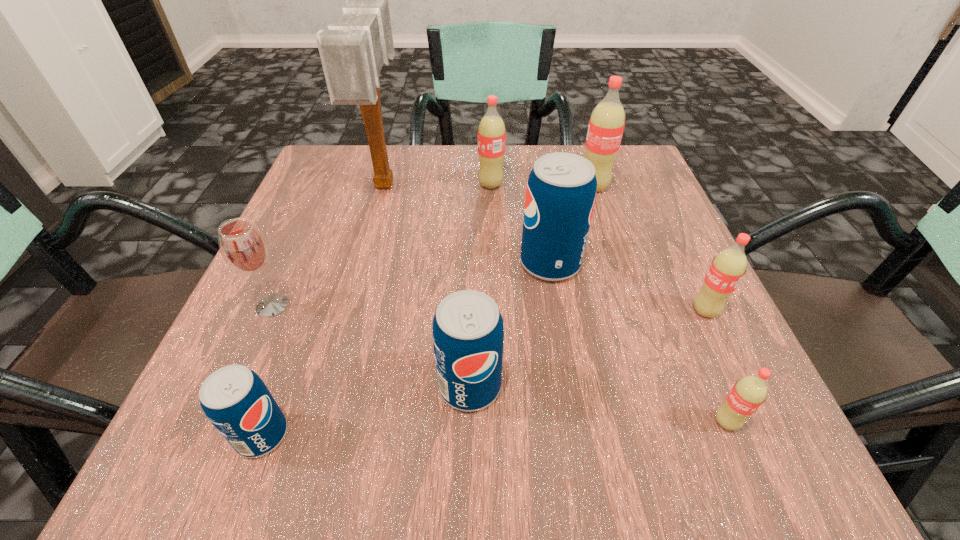
Identify the location of vacant space that's between the leftmost red soda and the fifth nearest soda. The image size is (960, 540). (520, 224).

This screenshot has width=960, height=540. I want to click on free area in between the fifth nearest soda and the smallest blue pop, so click(x=406, y=349).

I want to click on free space that is in between the third object from right to left and the leftmost soda, so click(x=428, y=311).

Identify the location of free area in between the mallet and the wineglass. This screenshot has width=960, height=540. (328, 245).

At what (x,y) coordinates should I click in order to perform the action: click on vacant space that's between the third smallest red soda and the fourth soda from right to left. Please return your answer as a coordinate pair (x, y). Looking at the image, I should click on (520, 224).

In order to click on empty space that is in between the third smallest red soda and the smallest red soda in this screenshot , I will do `click(609, 303)`.

The width and height of the screenshot is (960, 540). I want to click on free point between the sixth nearest object and the tallest object, so click(468, 224).

The image size is (960, 540). In order to click on object that can be found as the eighth closest to the second red soda from right to left in this screenshot , I will do `click(244, 248)`.

Image resolution: width=960 pixels, height=540 pixels. In order to click on object that stands as the closest to the smallest blue pop in this screenshot , I will do pos(244,248).

Select which soda appears as the fifth closest to the third object from left to right. Please provide its 2D coordinates. Your answer should be formatted as a tuple, i.e. [(x, y)], where the tuple contains the x and y coordinates of a point satisfying the conditions above.

[(235, 400)]